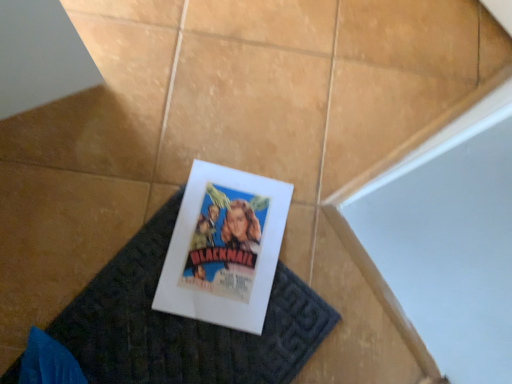
This screenshot has height=384, width=512. I want to click on empty space that is ontop of matte paper poster at center (from a real-world perspective), so click(x=223, y=243).